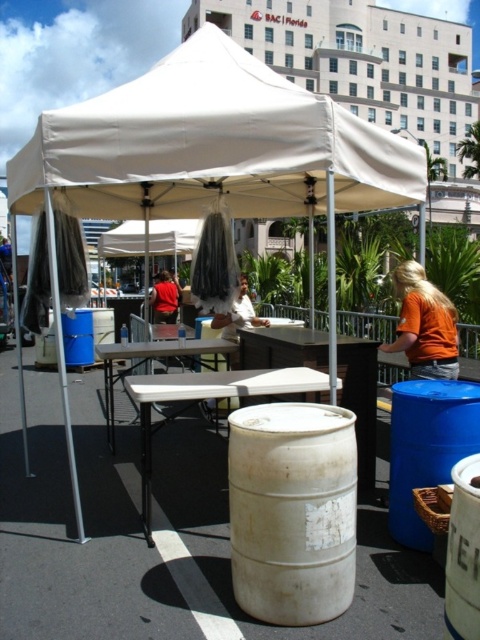
Question: Based on their relative distances, which object is nearer to the white fabric tent at center?

Choices:
 (A) white matte barrel at lower right
 (B) white plastic picnic table at center
 (C) matte red shirt at center
 (D) white fabric canopy at upper center

Answer: (B)

Question: Which object is farther from the camera taking this photo?

Choices:
 (A) blue plastic barrel at lower right
 (B) matte red shirt at center

Answer: (B)

Question: Can you confirm if orange cotton shirt at right is thinner than white matte barrel at lower right?

Choices:
 (A) no
 (B) yes

Answer: (A)

Question: Does white fabric tent at center have a lesser width compared to white plastic picnic table at center?

Choices:
 (A) yes
 (B) no

Answer: (B)

Question: Can you confirm if white fabric tent at center is smaller than white matte barrel at center?

Choices:
 (A) yes
 (B) no

Answer: (B)

Question: Among these objects, which one is nearest to the camera?

Choices:
 (A) white plastic table at center
 (B) orange cotton shirt at right
 (C) white matte barrel at lower right
 (D) matte red shirt at center

Answer: (C)